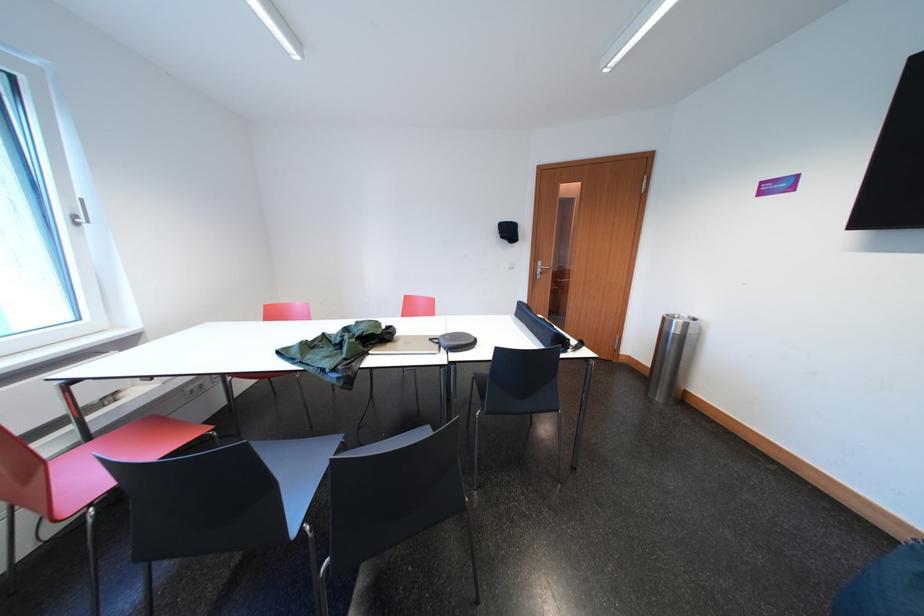
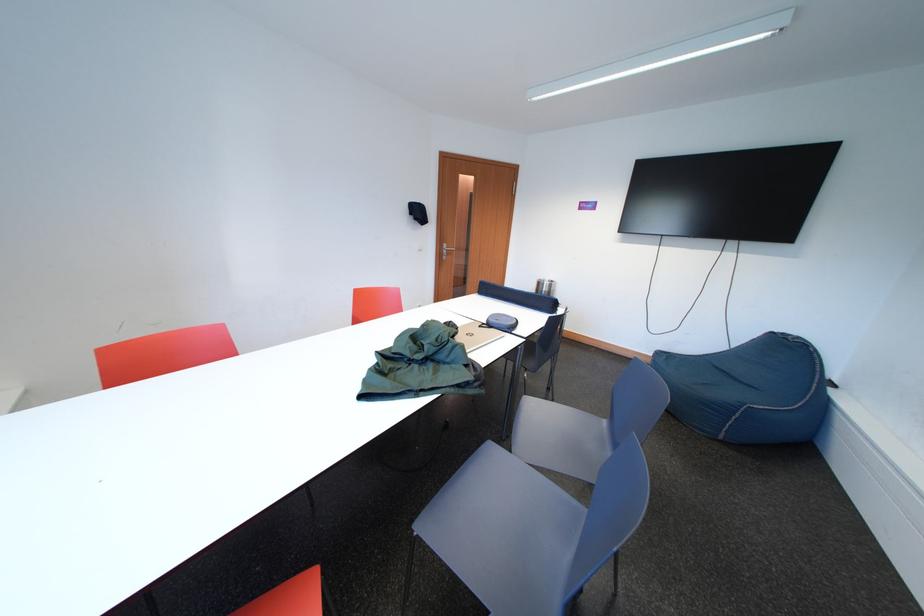
Find the pixel in the second image that matches point (550, 268) in the first image.

(455, 249)